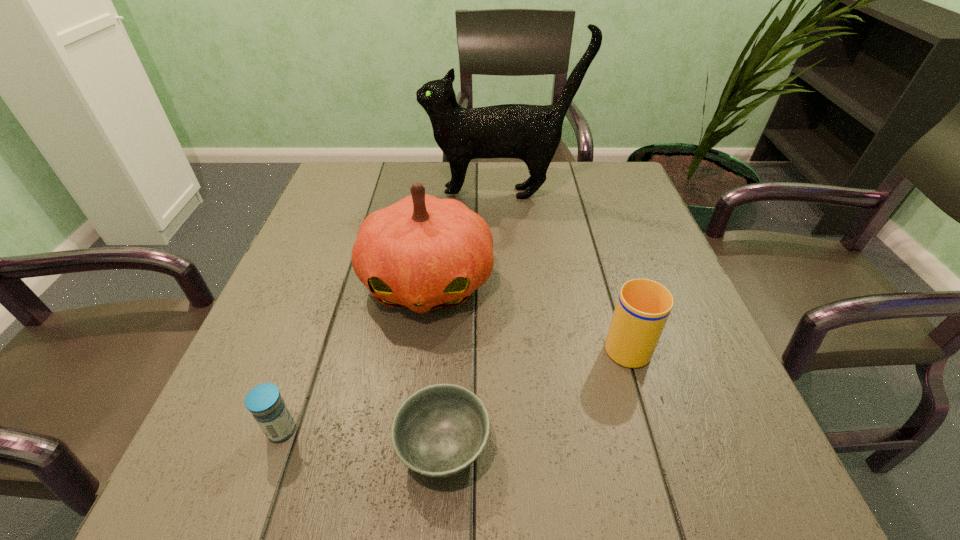
Locate an element on the screen. cup that is at the right edge is located at coordinates (643, 306).

Locate an element on the screen. object present at the far right corner is located at coordinates (532, 133).

In the image, there is a desktop. Where is `vacant space at the far edge`? vacant space at the far edge is located at coordinates (528, 174).

Identify the location of free space at the near edge. This screenshot has height=540, width=960. (384, 466).

Locate an element on the screen. This screenshot has width=960, height=540. vacant area at the left edge is located at coordinates (231, 447).

At what (x,y) coordinates should I click in order to perform the action: click on vacant position at the right edge of the desktop. Please return your answer as a coordinate pair (x, y). The height and width of the screenshot is (540, 960). Looking at the image, I should click on (656, 262).

Locate an element on the screen. free space at the far left corner of the desktop is located at coordinates (372, 201).

You are a GUI agent. You are given a task and a screenshot of the screen. Output one action in this format:
    pyautogui.click(x=<x>, y=<y>)
    Task: Click on the vacant space at the far right corner of the desktop
    
    Given the screenshot: What is the action you would take?
    pyautogui.click(x=594, y=168)

Find the location of `vacant space at the near right corner of the desktop`. vacant space at the near right corner of the desktop is located at coordinates (755, 464).

Identify the location of free space between the farthest object and the cup. (564, 268).